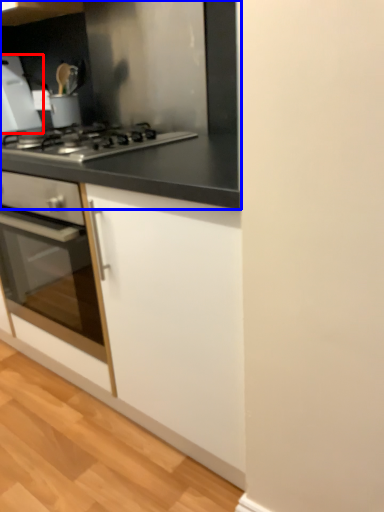
Question: Among these objects, which one is farthest to the camera, home appliance (highlighted by a red box) or countertop (highlighted by a blue box)?

Choices:
 (A) home appliance
 (B) countertop

Answer: (A)